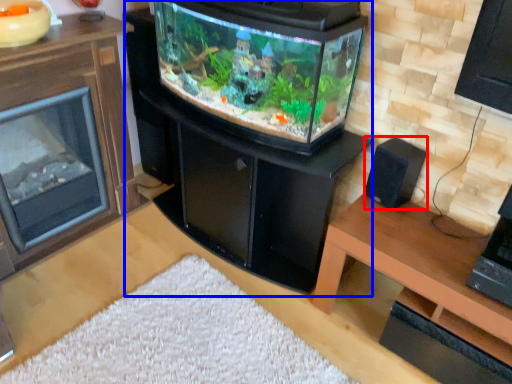
Question: Among these objects, which one is nearest to the camera, speaker (highlighted by a red box) or fireplace (highlighted by a blue box)?

Choices:
 (A) speaker
 (B) fireplace

Answer: (B)